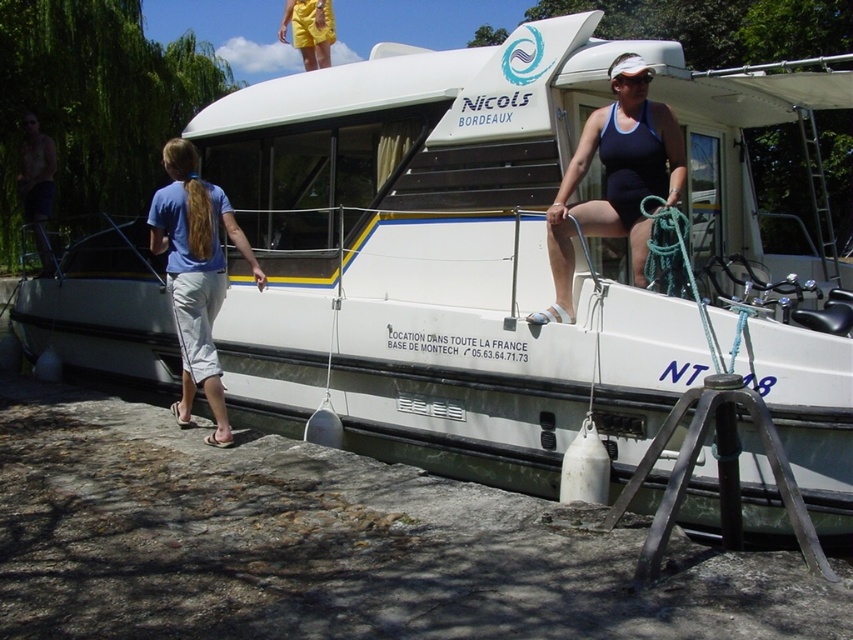
Which is in front, point (662, 168) or point (32, 160)?

Point (662, 168) is in front.

Is dark blue swimsuit at upper right above shiny metallic pole at left?

No.

Measure the distance between dark blue swimsuit at upper right and camera.

5.04 meters

You are a GUI agent. You are given a task and a screenshot of the screen. Output one action in this format:
    pyautogui.click(x=<x>, y=<y>)
    Task: Click on the dark blue swimsuit at upper right
    
    Given the screenshot: What is the action you would take?
    [x=614, y=179]

Looking at this image, between dark blue swimsuit at upper right and blue cotton shirt at left, which one appears on the right side from the viewer's perspective?

dark blue swimsuit at upper right

Which is below, dark blue swimsuit at upper right or blue cotton shirt at left?

Positioned lower is blue cotton shirt at left.

Which is behind, point (639, 260) or point (223, 260)?

The point (223, 260) is behind.

Locate an element on the screen. This screenshot has width=853, height=640. dark blue swimsuit at upper right is located at coordinates (614, 179).

Which is more to the right, blue cotton shirt at left or shiny metallic pole at left?

Positioned to the right is blue cotton shirt at left.

Can you confirm if blue cotton shirt at left is shorter than shiny metallic pole at left?

Yes, blue cotton shirt at left is shorter than shiny metallic pole at left.

This screenshot has width=853, height=640. What do you see at coordinates (195, 275) in the screenshot?
I see `blue cotton shirt at left` at bounding box center [195, 275].

This screenshot has height=640, width=853. I want to click on blue cotton shirt at left, so click(x=195, y=275).